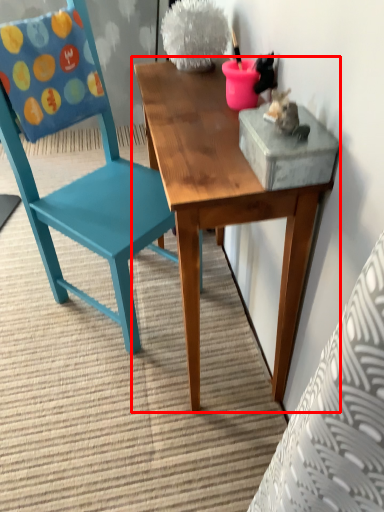
Question: In this image, where is table (annotated by the red box) located relative to chair?

Choices:
 (A) right
 (B) left

Answer: (A)